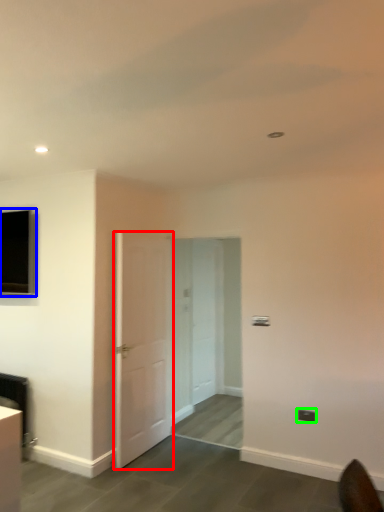
Question: Which is nearer to the door (highlighted by a red box)? window (highlighted by a blue box) or electric outlet (highlighted by a green box).

Choices:
 (A) window
 (B) electric outlet

Answer: (A)